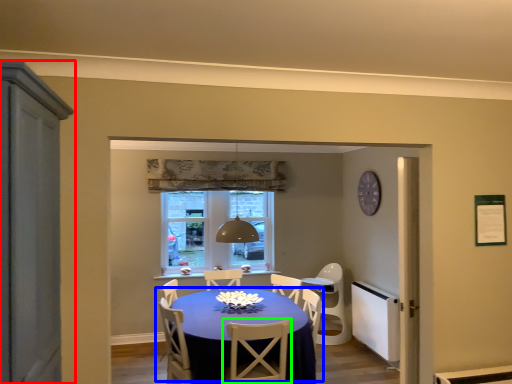
Question: Based on their relative distances, which object is farther from cabinetry (highlighted by a red box)? Choose from kitchen & dining room table (highlighted by a blue box) and chair (highlighted by a green box).

Choices:
 (A) kitchen & dining room table
 (B) chair

Answer: (A)